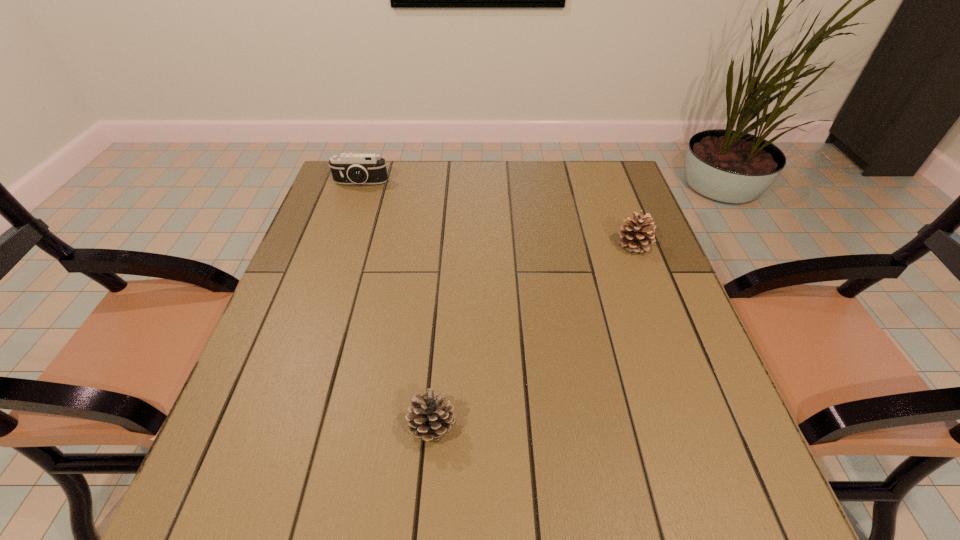
Identify the location of vacant region between the farther pinecone and the leftmost object. (497, 214).

Where is `vacant area that lies between the nearer pinecone and the farther pinecone`? The width and height of the screenshot is (960, 540). vacant area that lies between the nearer pinecone and the farther pinecone is located at coordinates (533, 336).

This screenshot has height=540, width=960. In order to click on vacant area that lies between the farther pinecone and the left pinecone in this screenshot , I will do `click(533, 336)`.

Image resolution: width=960 pixels, height=540 pixels. I want to click on empty space between the farther pinecone and the left pinecone, so click(533, 336).

At what (x,y) coordinates should I click in order to perform the action: click on free space between the farther pinecone and the leftmost object. Please return your answer as a coordinate pair (x, y). Looking at the image, I should click on (497, 214).

I want to click on free space between the camera and the left pinecone, so click(396, 305).

Locate an element on the screen. The image size is (960, 540). empty location between the rightmost object and the nearest object is located at coordinates (533, 336).

Locate an element on the screen. The width and height of the screenshot is (960, 540). vacant space in between the nearer pinecone and the farthest object is located at coordinates (396, 305).

Locate an element on the screen. free spot between the second farthest object and the second object from right to left is located at coordinates (533, 336).

Locate which object ranks second in proximity to the farthest object. Please provide its 2D coordinates. Your answer should be formatted as a tuple, i.e. [(x, y)], where the tuple contains the x and y coordinates of a point satisfying the conditions above.

[(430, 418)]